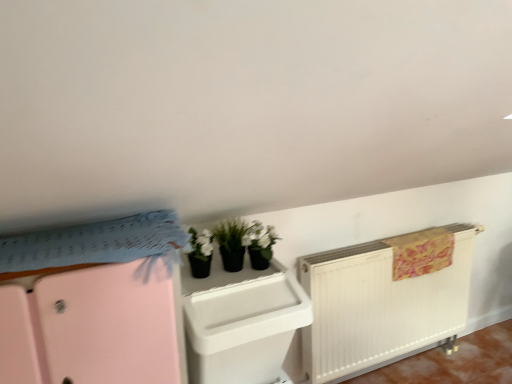
Measure the distance between point (208, 298) and camera.

A distance of 1.36 meters exists between point (208, 298) and camera.

This screenshot has height=384, width=512. Identify the location of white plastic file cabinet at center, marked as the second file cabinet in a left-to-right arrangement. (241, 322).

This screenshot has height=384, width=512. What do you see at coordinates (241, 322) in the screenshot? I see `white plastic file cabinet at center, acting as the first file cabinet starting from the right` at bounding box center [241, 322].

How much space does white plastic file cabinet at center, marked as the second file cabinet in a left-to-right arrangement, occupy vertically?

white plastic file cabinet at center, marked as the second file cabinet in a left-to-right arrangement, is 16.56 inches tall.

Measure the distance between pink matte/file cabinet at upper left, the first file cabinet in the left-to-right sequence, and camera.

pink matte/file cabinet at upper left, the first file cabinet in the left-to-right sequence, is 36.13 inches away from camera.

In order to click on pink matte/file cabinet at upper left, the first file cabinet in the left-to-right sequence in this screenshot , I will do `click(93, 328)`.

Describe the element at coordinates (93, 328) in the screenshot. I see `pink matte/file cabinet at upper left, the first file cabinet in the left-to-right sequence` at that location.

Looking at this image, how much space does pink matte/file cabinet at upper left, arranged as the second file cabinet when viewed from the right, occupy horizontally?

58.64 centimeters.

You are a GUI agent. You are given a task and a screenshot of the screen. Output one action in this format:
    pyautogui.click(x=<x>, y=<y>)
    Task: Click on the white plastic file cabinet at center, acting as the first file cabinet starting from the right
    Image resolution: width=512 pixels, height=384 pixels.
    Given the screenshot: What is the action you would take?
    pyautogui.click(x=241, y=322)

Does white plastic file cabinet at center, acting as the first file cabinet starting from the right, appear on the left side of pink matte/file cabinet at upper left, the first file cabinet in the left-to-right sequence?

No, white plastic file cabinet at center, acting as the first file cabinet starting from the right, is not to the left of pink matte/file cabinet at upper left, the first file cabinet in the left-to-right sequence.

Relative to pink matte/file cabinet at upper left, the first file cabinet in the left-to-right sequence, is white plastic file cabinet at center, acting as the first file cabinet starting from the right, in front or behind?

Clearly, white plastic file cabinet at center, acting as the first file cabinet starting from the right, is behind pink matte/file cabinet at upper left, the first file cabinet in the left-to-right sequence.

Is point (233, 357) closer or farther from the camera than point (12, 301)?

Clearly, point (233, 357) is more distant from the camera than point (12, 301).

From the image's perspective, would you say white plastic file cabinet at center, marked as the second file cabinet in a left-to-right arrangement, is shown under pink matte/file cabinet at upper left, the first file cabinet in the left-to-right sequence?

No, from the image's perspective, white plastic file cabinet at center, marked as the second file cabinet in a left-to-right arrangement, is not below pink matte/file cabinet at upper left, the first file cabinet in the left-to-right sequence.

Looking at this image, from a real-world perspective, is white plastic file cabinet at center, marked as the second file cabinet in a left-to-right arrangement, physically below pink matte/file cabinet at upper left, the first file cabinet in the left-to-right sequence?

Yes, from a real-world perspective, white plastic file cabinet at center, marked as the second file cabinet in a left-to-right arrangement, is under pink matte/file cabinet at upper left, the first file cabinet in the left-to-right sequence.

Considering the sizes of objects white plastic file cabinet at center, marked as the second file cabinet in a left-to-right arrangement, and pink matte/file cabinet at upper left, the first file cabinet in the left-to-right sequence, in the image provided, who is wider, white plastic file cabinet at center, marked as the second file cabinet in a left-to-right arrangement, or pink matte/file cabinet at upper left, the first file cabinet in the left-to-right sequence,?

Wider between the two is pink matte/file cabinet at upper left, the first file cabinet in the left-to-right sequence.

Is white plastic file cabinet at center, acting as the first file cabinet starting from the right, shorter than pink matte/file cabinet at upper left, the first file cabinet in the left-to-right sequence?

Correct, white plastic file cabinet at center, acting as the first file cabinet starting from the right, is not as tall as pink matte/file cabinet at upper left, the first file cabinet in the left-to-right sequence.

Looking at the image, does white plastic file cabinet at center, acting as the first file cabinet starting from the right, seem bigger or smaller compared to pink matte/file cabinet at upper left, arranged as the second file cabinet when viewed from the right?

white plastic file cabinet at center, acting as the first file cabinet starting from the right, is smaller than pink matte/file cabinet at upper left, arranged as the second file cabinet when viewed from the right.

Is white plastic file cabinet at center, marked as the second file cabinet in a left-to-right arrangement, positioned beyond the bounds of pink matte/file cabinet at upper left, the first file cabinet in the left-to-right sequence?

Absolutely, white plastic file cabinet at center, marked as the second file cabinet in a left-to-right arrangement, is external to pink matte/file cabinet at upper left, the first file cabinet in the left-to-right sequence.

From the picture: Is white plastic file cabinet at center, marked as the second file cabinet in a left-to-right arrangement, in contact with pink matte/file cabinet at upper left, arranged as the second file cabinet when viewed from the right?

No, white plastic file cabinet at center, marked as the second file cabinet in a left-to-right arrangement, is not next to pink matte/file cabinet at upper left, arranged as the second file cabinet when viewed from the right.

Is white plastic file cabinet at center, acting as the first file cabinet starting from the right, facing towards pink matte/file cabinet at upper left, arranged as the second file cabinet when viewed from the right?

No, white plastic file cabinet at center, acting as the first file cabinet starting from the right, is not aimed at pink matte/file cabinet at upper left, arranged as the second file cabinet when viewed from the right.

How much distance is there between white plastic file cabinet at center, marked as the second file cabinet in a left-to-right arrangement, and pink matte/file cabinet at upper left, arranged as the second file cabinet when viewed from the right?

12.61 inches.

The image size is (512, 384). What are the coordinates of `file cabinet in front of the white plastic file cabinet at center, marked as the second file cabinet in a left-to-right arrangement` in the screenshot? It's located at (93, 328).

Is pink matte/file cabinet at upper left, arranged as the second file cabinet when viewed from the right, at the right side of white plastic file cabinet at center, acting as the first file cabinet starting from the right?

In fact, pink matte/file cabinet at upper left, arranged as the second file cabinet when viewed from the right, is to the left of white plastic file cabinet at center, acting as the first file cabinet starting from the right.

Which is behind, pink matte/file cabinet at upper left, arranged as the second file cabinet when viewed from the right, or white plastic file cabinet at center, marked as the second file cabinet in a left-to-right arrangement?

Positioned behind is white plastic file cabinet at center, marked as the second file cabinet in a left-to-right arrangement.

Does point (102, 304) appear closer or farther from the camera than point (281, 322)?

Point (102, 304).

From the image's perspective, is pink matte/file cabinet at upper left, arranged as the second file cabinet when viewed from the right, above or below white plastic file cabinet at center, marked as the second file cabinet in a left-to-right arrangement?

pink matte/file cabinet at upper left, arranged as the second file cabinet when viewed from the right, is situated lower than white plastic file cabinet at center, marked as the second file cabinet in a left-to-right arrangement, in the image.

From a real-world perspective, who is located lower, pink matte/file cabinet at upper left, the first file cabinet in the left-to-right sequence, or white plastic file cabinet at center, marked as the second file cabinet in a left-to-right arrangement?

white plastic file cabinet at center, marked as the second file cabinet in a left-to-right arrangement, from a real-world perspective.

Which object is thinner, pink matte/file cabinet at upper left, arranged as the second file cabinet when viewed from the right, or white plastic file cabinet at center, marked as the second file cabinet in a left-to-right arrangement?

With smaller width is white plastic file cabinet at center, marked as the second file cabinet in a left-to-right arrangement.

Consider the image. Is pink matte/file cabinet at upper left, arranged as the second file cabinet when viewed from the right, taller or shorter than white plastic file cabinet at center, acting as the first file cabinet starting from the right?

Clearly, pink matte/file cabinet at upper left, arranged as the second file cabinet when viewed from the right, is taller compared to white plastic file cabinet at center, acting as the first file cabinet starting from the right.

Does pink matte/file cabinet at upper left, arranged as the second file cabinet when viewed from the right, have a larger size compared to white plastic file cabinet at center, acting as the first file cabinet starting from the right?

Yes.

Is pink matte/file cabinet at upper left, arranged as the second file cabinet when viewed from the right, not within white plastic file cabinet at center, marked as the second file cabinet in a left-to-right arrangement?

Yes, pink matte/file cabinet at upper left, arranged as the second file cabinet when viewed from the right, is located beyond the bounds of white plastic file cabinet at center, marked as the second file cabinet in a left-to-right arrangement.

Is pink matte/file cabinet at upper left, the first file cabinet in the left-to-right sequence, beside white plastic file cabinet at center, marked as the second file cabinet in a left-to-right arrangement?

No, pink matte/file cabinet at upper left, the first file cabinet in the left-to-right sequence, is not in contact with white plastic file cabinet at center, marked as the second file cabinet in a left-to-right arrangement.

Could you tell me if pink matte/file cabinet at upper left, the first file cabinet in the left-to-right sequence, is facing white plastic file cabinet at center, marked as the second file cabinet in a left-to-right arrangement?

No, pink matte/file cabinet at upper left, the first file cabinet in the left-to-right sequence, is not aimed at white plastic file cabinet at center, marked as the second file cabinet in a left-to-right arrangement.

Locate an element on the screen. file cabinet behind the pink matte/file cabinet at upper left, arranged as the second file cabinet when viewed from the right is located at coordinates (241, 322).

The image size is (512, 384). I want to click on file cabinet located on the right of pink matte/file cabinet at upper left, the first file cabinet in the left-to-right sequence, so click(x=241, y=322).

The width and height of the screenshot is (512, 384). I want to click on file cabinet located behind the pink matte/file cabinet at upper left, arranged as the second file cabinet when viewed from the right, so click(x=241, y=322).